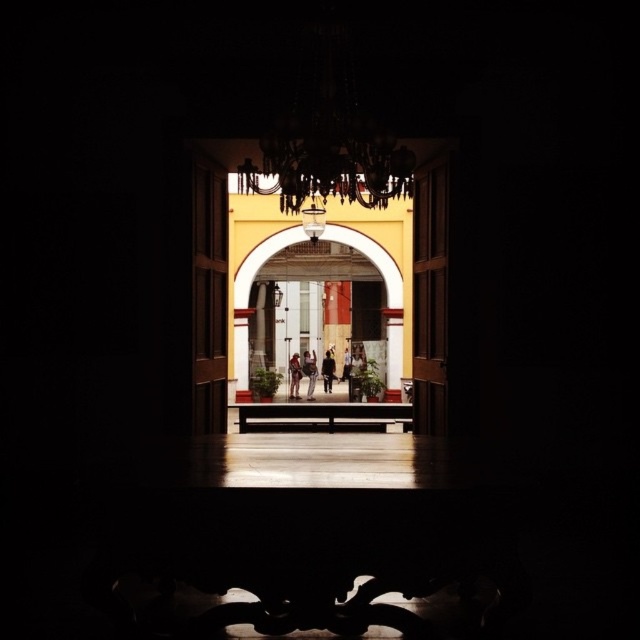
Question: Can you confirm if silvery metallic chandelier at upper center is smaller than matte black jacket at center?

Choices:
 (A) no
 (B) yes

Answer: (A)

Question: Is silvery metallic chandelier at upper center bigger than dark brown leather jacket at center?

Choices:
 (A) no
 (B) yes

Answer: (B)

Question: Is silvery metallic chandelier at upper center to the right of matte black jacket at center from the viewer's perspective?

Choices:
 (A) yes
 (B) no

Answer: (A)

Question: Based on their relative distances, which object is nearer to the white marble archway at center?

Choices:
 (A) light brown leather jacket at center
 (B) matte black jacket at center

Answer: (A)

Question: Which of the following is the farthest from the observer?

Choices:
 (A) (358, 250)
 (B) (324, 368)

Answer: (B)

Question: Which object is closer to the camera taking this photo?

Choices:
 (A) silvery metallic chandelier at upper center
 (B) dark brown leather jacket at center
 (C) white marble archway at center

Answer: (A)